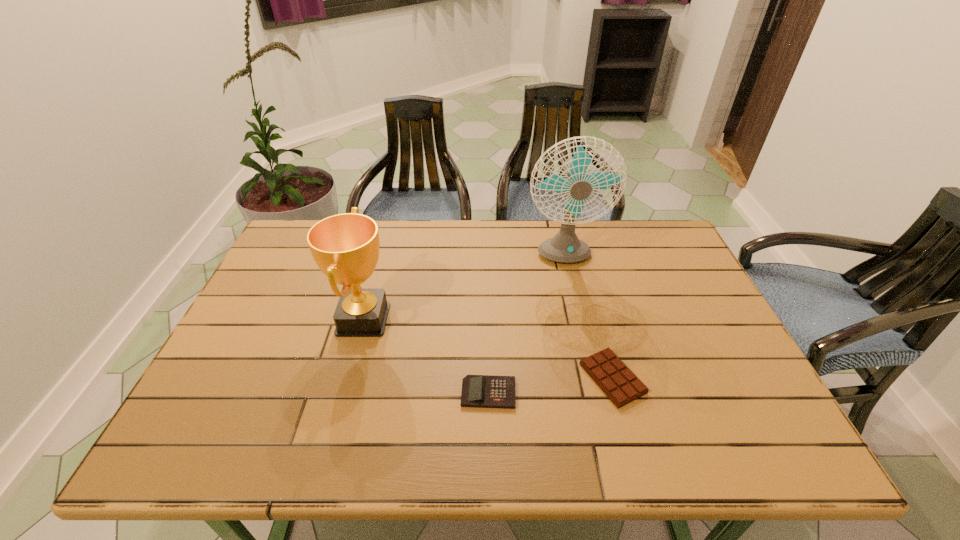
This screenshot has width=960, height=540. I want to click on object located in the far edge section of the desktop, so click(x=565, y=247).

Where is `free spot at the far edge of the desktop`? The height and width of the screenshot is (540, 960). free spot at the far edge of the desktop is located at coordinates (414, 241).

Locate an element on the screen. The image size is (960, 540). blank space at the near edge is located at coordinates (544, 429).

What are the coordinates of `blank space at the left edge of the desktop` in the screenshot? It's located at (293, 284).

The width and height of the screenshot is (960, 540). In order to click on vacant region at the right edge of the desktop in this screenshot , I will do `click(692, 270)`.

Find the location of a particular element. The image size is (960, 540). vacant region at the near left corner of the desktop is located at coordinates [x=195, y=444].

At what (x,y) coordinates should I click in order to perform the action: click on blank space at the near right corner. Please return your answer as a coordinate pair (x, y). Looking at the image, I should click on (754, 441).

Locate an element on the screen. The width and height of the screenshot is (960, 540). free space between the third object from right to left and the award is located at coordinates (426, 356).

Identify the location of free area in between the farthest object and the leftmost object. The image size is (960, 540). (463, 289).

At what (x,y) coordinates should I click in order to perform the action: click on unoccupied area between the calculator and the candy bar. Please return your answer as a coordinate pair (x, y). This screenshot has height=540, width=960. Looking at the image, I should click on (550, 386).